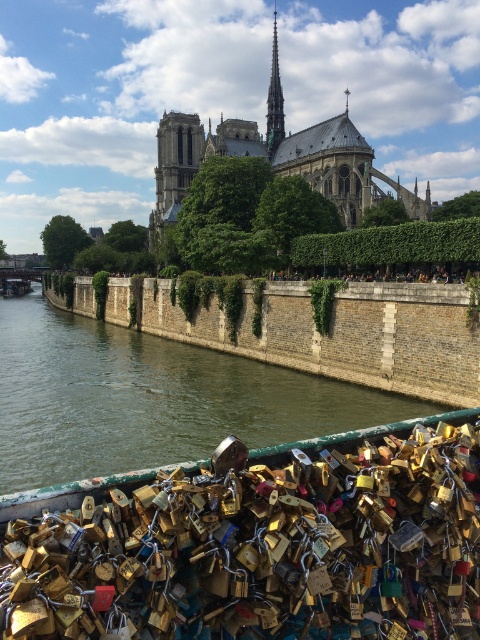
Question: Is gold metallic padlocks at center closer to the viewer compared to smooth gray spire at upper center?

Choices:
 (A) yes
 (B) no

Answer: (A)

Question: Does gold metallic padlocks at center appear on the left side of smooth gray spire at upper center?

Choices:
 (A) yes
 (B) no

Answer: (B)

Question: Which point is farther to the camera?

Choices:
 (A) gold metallic padlocks at center
 (B) smooth gray spire at upper center
 (C) stone gothic cathedral at center
 (D) brown stone wall at lower center

Answer: (B)

Question: Which of the following is the farthest from the observer?

Choices:
 (A) (396, 264)
 (B) (336, 134)
 (C) (400, 344)

Answer: (B)

Question: Does brown stone wall at lower center have a smaller size compared to stone gothic cathedral at center?

Choices:
 (A) yes
 (B) no

Answer: (A)

Question: Based on their relative distances, which object is nearer to the stone gothic cathedral at center?

Choices:
 (A) brown stone wall at lower center
 (B) gold metallic padlocks at center
 (C) smooth gray spire at upper center

Answer: (C)